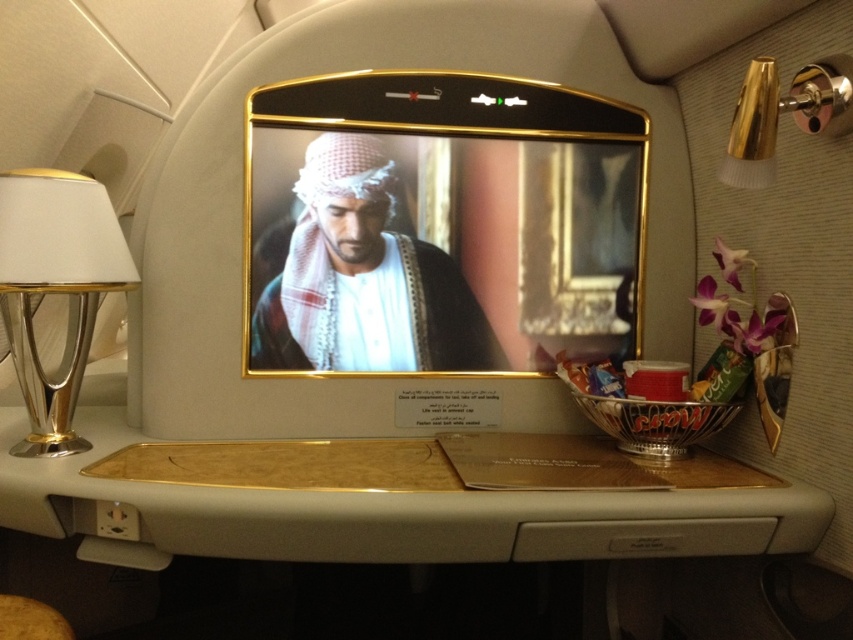
Question: Is gold wood tray at center positioned before matte white headscarf at center?

Choices:
 (A) no
 (B) yes

Answer: (B)

Question: Is gold wood tray at center thinner than matte white headscarf at center?

Choices:
 (A) yes
 (B) no

Answer: (B)

Question: Does gold wood tray at center have a greater width compared to gold metallic lamp at upper right?

Choices:
 (A) no
 (B) yes

Answer: (B)

Question: Among these points, which one is farthest from the camera?

Choices:
 (A) (3, 188)
 (B) (181, 467)
 (C) (474, 333)
 (D) (16, 627)

Answer: (C)

Question: Among these objects, which one is farthest from the camera?

Choices:
 (A) wooden stool at lower left
 (B) matte white headscarf at center
 (C) gold metallic lamp at upper right

Answer: (B)

Question: Which of these objects is positioned farthest from the metallic silver lamp at left?

Choices:
 (A) wooden stool at lower left
 (B) matte white headscarf at center

Answer: (A)